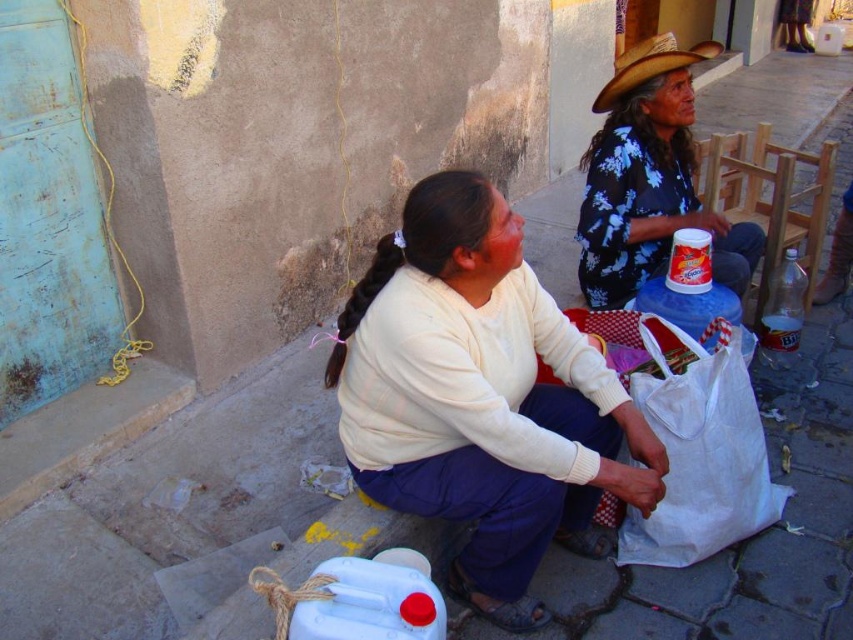
Question: Does white plastic bag at lower right have a smaller size compared to straw textured cowboy hat at upper right?

Choices:
 (A) no
 (B) yes

Answer: (A)

Question: Estimate the real-world distances between objects in this image. Which object is closer to the straw textured cowboy hat at upper right?

Choices:
 (A) floral fabric blouse at upper right
 (B) white plastic bag at lower right

Answer: (A)

Question: Which point is closer to the camera?

Choices:
 (A) floral fabric blouse at upper right
 (B) white plastic bag at lower right
 (C) white matte sweater at center
 (D) straw textured cowboy hat at upper right

Answer: (C)

Question: Is floral fabric blouse at upper right to the right of white plastic bag at lower right from the viewer's perspective?

Choices:
 (A) yes
 (B) no

Answer: (A)

Question: Can you confirm if floral fabric blouse at upper right is positioned above straw textured cowboy hat at upper right?

Choices:
 (A) no
 (B) yes

Answer: (A)

Question: Considering the real-world distances, which object is closest to the floral fabric blouse at upper right?

Choices:
 (A) straw textured cowboy hat at upper right
 (B) white plastic bag at lower right

Answer: (A)